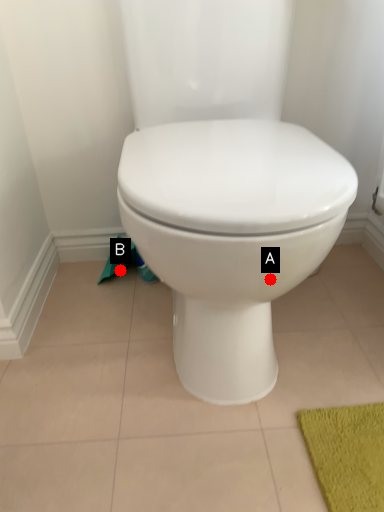
Question: Two points are circled on the image, labeled by A and B beside each circle. Which point appears farthest from the camera in this image?

Choices:
 (A) A is further
 (B) B is further

Answer: (B)